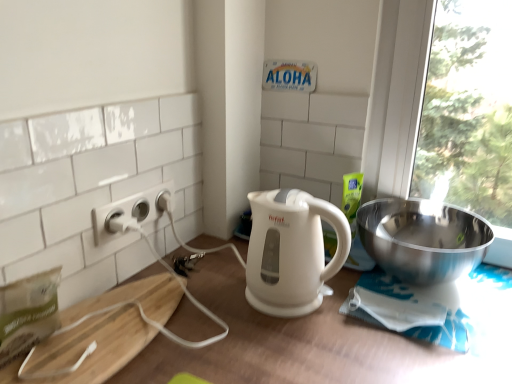
I want to click on vacant region under polished stainless steel bowl at right (from a real-world perspective), so click(401, 281).